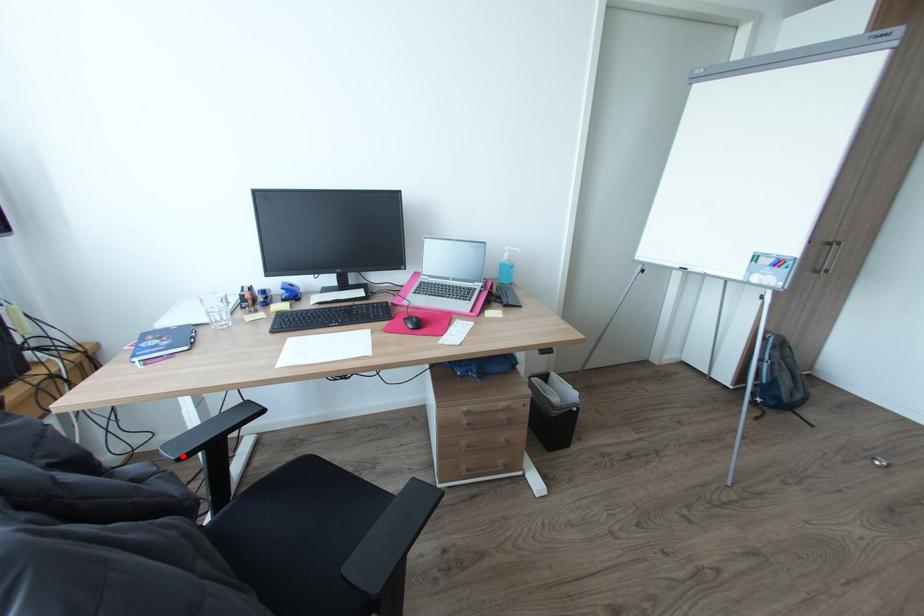
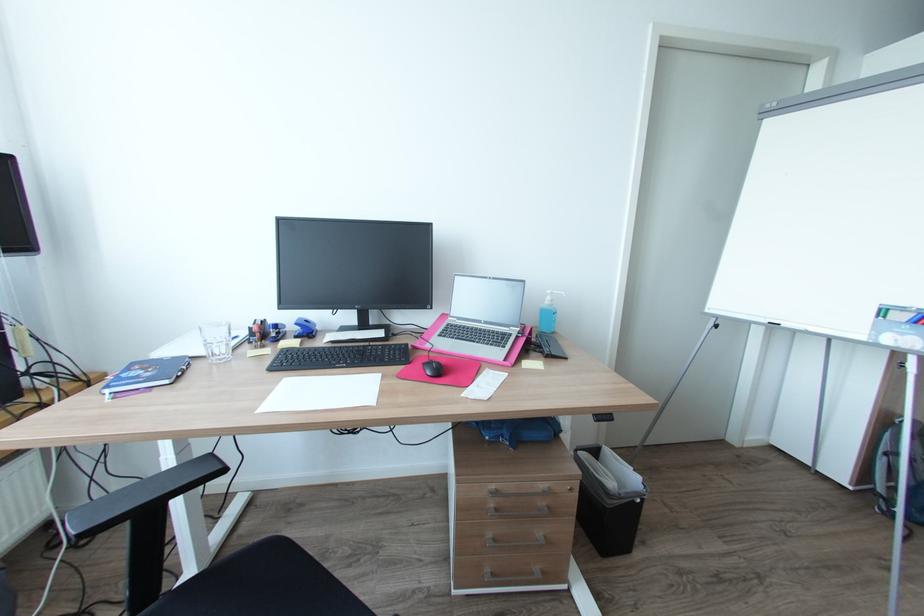
Question: I am providing you with two images of the same scene from different viewpoints. In image1, a red point is highlighted. Considering the same 3D point in image2, which of the following is correct?

Choices:
 (A) It is closer
 (B) It is farther

Answer: (B)